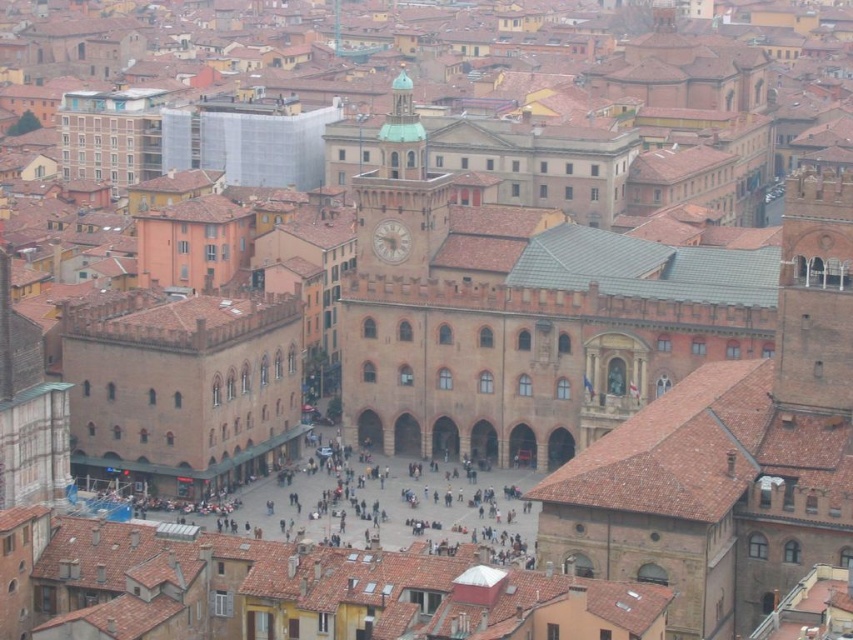
You are a tourist standing at the edge of the dark gray stone plaza at center. You want to reach the white marble clock at center as quickly as possible. What is the shortest distance you need to walk?

The shortest distance you need to walk is 62.85 feet to reach the white marble clock at center from the dark gray stone plaza at center.

You are a drone operator flying over the city. You have two points marked on your screen, point 1 at coordinates point (325, 525) and point 2 at coordinates point (358, 184). Which point is closer to your drone camera?

Point (325, 525) is closer to the camera than point (358, 184).